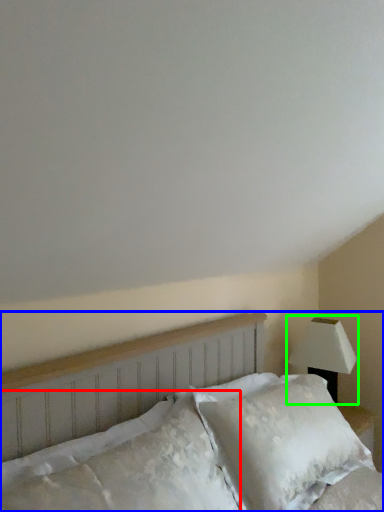
Question: Which object is the closest to the pillow (highlighted by a red box)? Choose among these: bed (highlighted by a blue box) or lamp (highlighted by a green box).

Choices:
 (A) bed
 (B) lamp

Answer: (A)